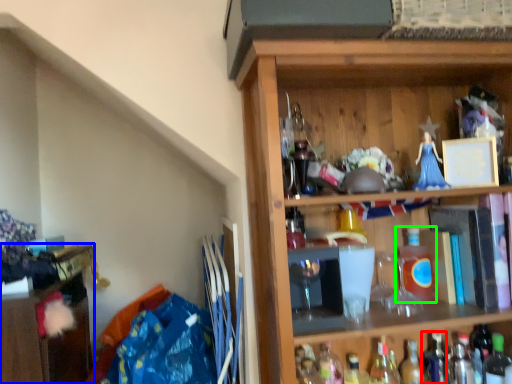
Question: Based on their relative distances, which object is farther from bottle (highlighted by a red box)? Choose from cabinetry (highlighted by a blue box) and bottle (highlighted by a green box).

Choices:
 (A) cabinetry
 (B) bottle

Answer: (A)